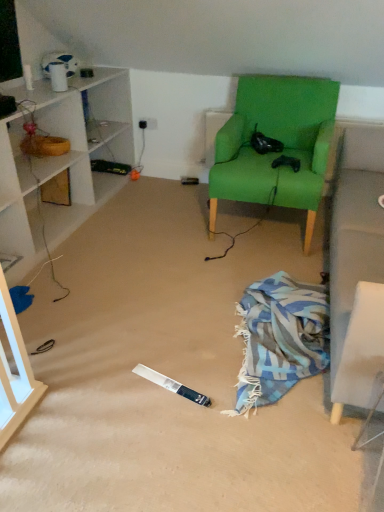
Image resolution: width=384 pixels, height=512 pixels. What do you see at coordinates (279, 339) in the screenshot? I see `blue woven blanket at lower right` at bounding box center [279, 339].

Locate an element on the screen. blue woven blanket at lower right is located at coordinates (279, 339).

Describe the element at coordinates (278, 140) in the screenshot. This screenshot has width=384, height=512. I see `green fabric chair at center` at that location.

The height and width of the screenshot is (512, 384). I want to click on green fabric chair at center, so click(x=278, y=140).

Locate an element on the screen. The width and height of the screenshot is (384, 512). blue woven blanket at lower right is located at coordinates (279, 339).

Which object is positioned more to the left, blue woven blanket at lower right or green fabric chair at center?

From the viewer's perspective, blue woven blanket at lower right appears more on the left side.

Considering their positions, is blue woven blanket at lower right located in front of or behind green fabric chair at center?

blue woven blanket at lower right is in front of green fabric chair at center.

Between point (260, 362) and point (220, 193), which one is positioned behind?

The point (220, 193) is behind.

From the image's perspective, is blue woven blanket at lower right above or below green fabric chair at center?

Clearly, from the image's perspective, blue woven blanket at lower right is below green fabric chair at center.

From a real-world perspective, is blue woven blanket at lower right above or below green fabric chair at center?

blue woven blanket at lower right is below green fabric chair at center.

Considering the sizes of objects blue woven blanket at lower right and green fabric chair at center in the image provided, who is wider, blue woven blanket at lower right or green fabric chair at center?

blue woven blanket at lower right is wider.

Considering the relative sizes of blue woven blanket at lower right and green fabric chair at center in the image provided, is blue woven blanket at lower right taller than green fabric chair at center?

In fact, blue woven blanket at lower right may be shorter than green fabric chair at center.

Between blue woven blanket at lower right and green fabric chair at center, which one has smaller size?

Smaller between the two is blue woven blanket at lower right.

Can we say blue woven blanket at lower right lies outside green fabric chair at center?

Yes, blue woven blanket at lower right is not within green fabric chair at center.

Is blue woven blanket at lower right positioned far away from green fabric chair at center?

blue woven blanket at lower right is near green fabric chair at center, not far away.

Is blue woven blanket at lower right looking in the opposite direction of green fabric chair at center?

Correct, blue woven blanket at lower right is looking away from green fabric chair at center.

In the scene shown: How different are the orientations of blue woven blanket at lower right and green fabric chair at center in degrees?

They differ by 2.47 degrees in their facing directions.

Locate an element on the screen. blanket below the green fabric chair at center (from a real-world perspective) is located at coordinates (279, 339).

Between green fabric chair at center and blue woven blanket at lower right, which one appears on the left side from the viewer's perspective?

blue woven blanket at lower right is more to the left.

From the picture: Is green fabric chair at center in front of blue woven blanket at lower right?

No.

Considering the positions of point (320, 184) and point (268, 332), is point (320, 184) closer or farther from the camera than point (268, 332)?

Point (320, 184).

From the image's perspective, between green fabric chair at center and blue woven blanket at lower right, which one is located above?

From the image's view, green fabric chair at center is above.

Based on the photo, from a real-world perspective, which is physically below, green fabric chair at center or blue woven blanket at lower right?

blue woven blanket at lower right.

Does green fabric chair at center have a lesser width compared to blue woven blanket at lower right?

Correct, the width of green fabric chair at center is less than that of blue woven blanket at lower right.

Is green fabric chair at center taller or shorter than blue woven blanket at lower right?

Considering their sizes, green fabric chair at center has more height than blue woven blanket at lower right.

Who is smaller, green fabric chair at center or blue woven blanket at lower right?

blue woven blanket at lower right.

Is blue woven blanket at lower right located within green fabric chair at center?

No, blue woven blanket at lower right is not surrounded by green fabric chair at center.

From the picture: Are green fabric chair at center and blue woven blanket at lower right far apart?

No.

Is green fabric chair at center positioned with its back to blue woven blanket at lower right?

No, green fabric chair at center is not facing the opposite direction of blue woven blanket at lower right.

How much distance is there between green fabric chair at center and blue woven blanket at lower right?

A distance of 33.35 inches exists between green fabric chair at center and blue woven blanket at lower right.

Locate an element on the screen. The width and height of the screenshot is (384, 512). chair above the blue woven blanket at lower right (from a real-world perspective) is located at coordinates (278, 140).

This screenshot has height=512, width=384. Find the location of `blanket that is under the green fabric chair at center (from a real-world perspective)`. blanket that is under the green fabric chair at center (from a real-world perspective) is located at coordinates (279, 339).

Locate an element on the screen. blanket located on the left of green fabric chair at center is located at coordinates (279, 339).